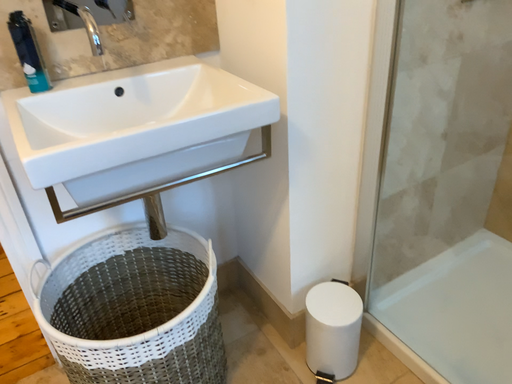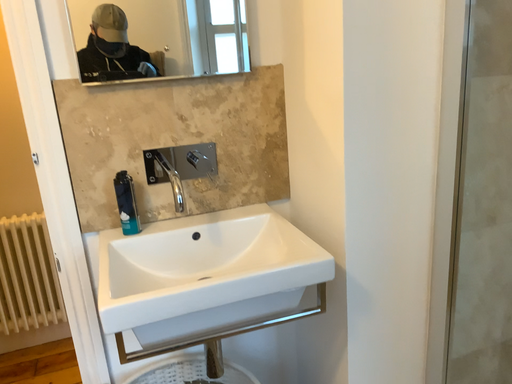
Question: Which way did the camera rotate in the video?

Choices:
 (A) rotated left
 (B) rotated right

Answer: (A)